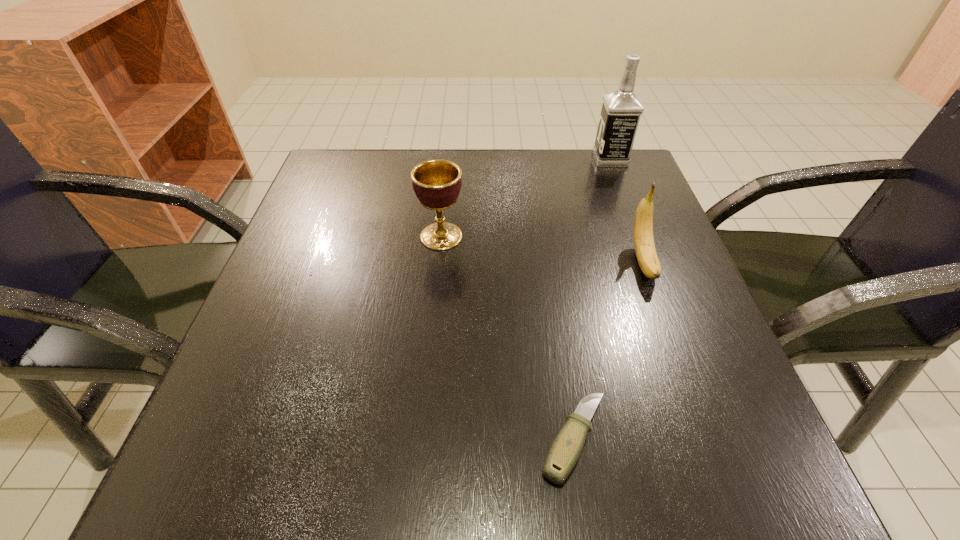
Find the location of `free space at the far left corner of the desktop`. free space at the far left corner of the desktop is located at coordinates (330, 175).

At what (x,y) coordinates should I click in order to perform the action: click on vacant region at the far right corner of the desktop. Please return your answer as a coordinate pair (x, y). This screenshot has height=540, width=960. Looking at the image, I should click on (579, 161).

The image size is (960, 540). In order to click on vacant point at the near right corner in this screenshot , I will do `click(661, 450)`.

I want to click on free space that is in between the shortest object and the tallest object, so click(592, 299).

Image resolution: width=960 pixels, height=540 pixels. I want to click on vacant point located between the farthest object and the banana, so click(x=627, y=210).

At what (x,y) coordinates should I click in order to perform the action: click on vacant area between the banana and the chalice. Please return your answer as a coordinate pair (x, y). This screenshot has width=960, height=540. Looking at the image, I should click on (542, 249).

I want to click on vacant point located between the farthest object and the chalice, so click(x=526, y=198).

At what (x,y) coordinates should I click in order to perform the action: click on empty space that is in between the banana and the chalice. Please return your answer as a coordinate pair (x, y). This screenshot has width=960, height=540. Looking at the image, I should click on (542, 249).

Identify the location of empty location between the nearest object and the chalice. pyautogui.click(x=508, y=338).

At what (x,y) coordinates should I click in order to perform the action: click on free space between the nearest object and the farthest object. Please return your answer as a coordinate pair (x, y). Looking at the image, I should click on (592, 299).